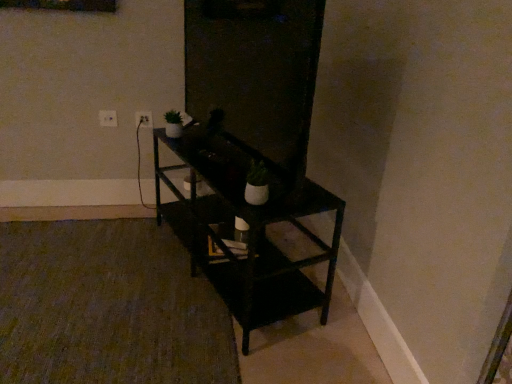
The image size is (512, 384). I want to click on free space behind white matte pot at center, which is counted as the 2th houseplant, starting from the left, so click(x=230, y=181).